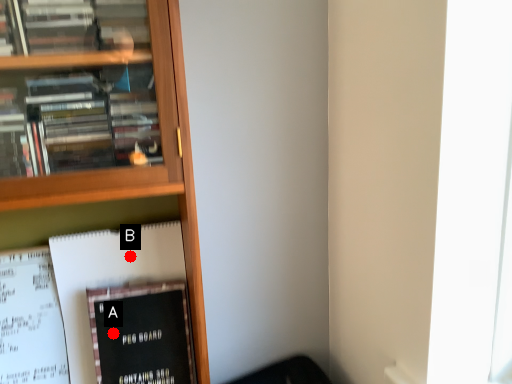
Question: Two points are circled on the image, labeled by A and B beside each circle. Which point is further to the camera?

Choices:
 (A) A is further
 (B) B is further

Answer: (B)